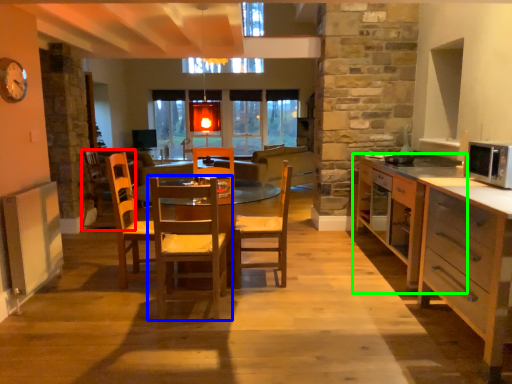
Question: Considering the real-world distances, which object is closest to armchair (highlighted by a red box)? chair (highlighted by a blue box) or cabinetry (highlighted by a green box).

Choices:
 (A) chair
 (B) cabinetry

Answer: (A)